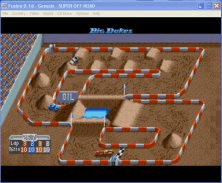
The height and width of the screenshot is (183, 222). Identify the location of window. (136, 6).